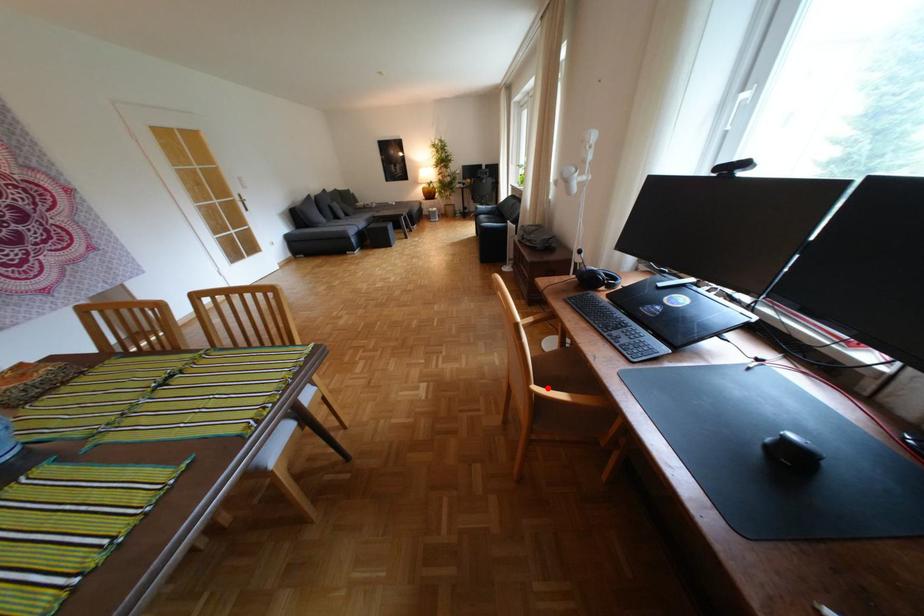
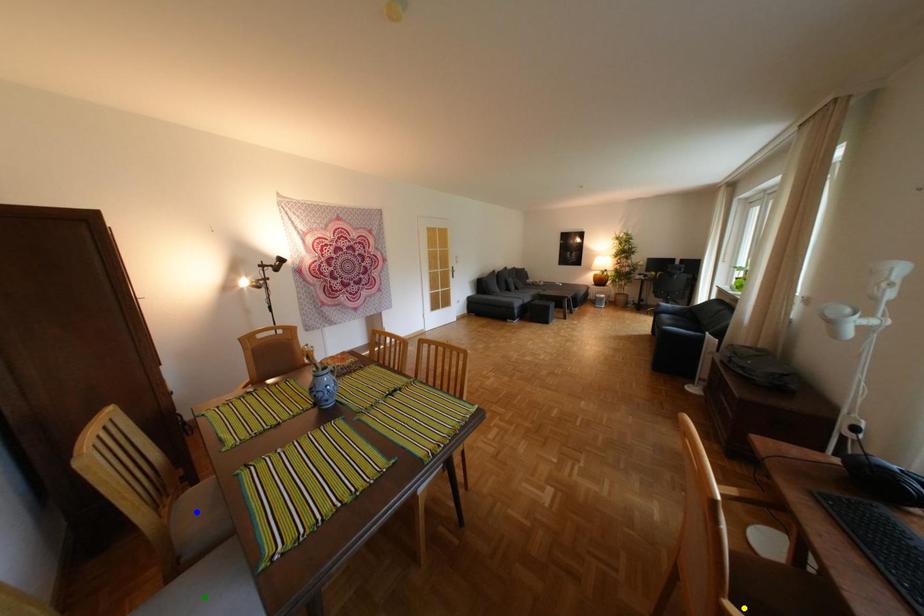
Question: I am providing you with two images of the same scene from different viewpoints. A red point is marked on the first image. You are given multiple points on the second image. In image 2, which mark is for the same physical point as the one in image 1?

Choices:
 (A) yellow point
 (B) blue point
 (C) green point

Answer: (A)